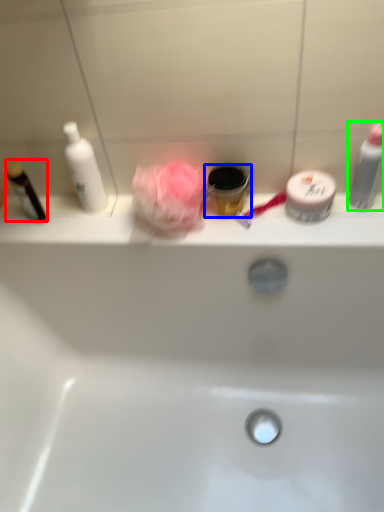
Question: Which object is the farthest from toiletry (highlighted by a red box)? Choose among these: toiletry (highlighted by a blue box) or toiletry (highlighted by a green box).

Choices:
 (A) toiletry
 (B) toiletry

Answer: (B)